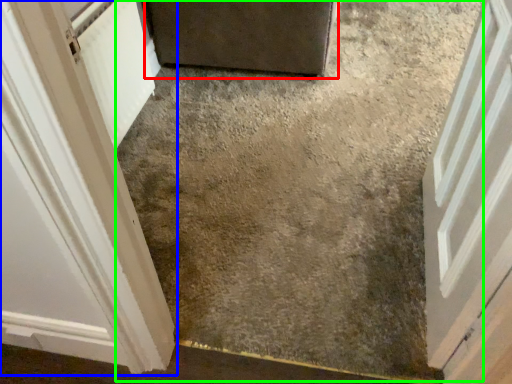
Question: Which object is positioned farthest from door (highlighted by a red box)? Select from door (highlighted by a blue box) and concrete (highlighted by a green box).

Choices:
 (A) door
 (B) concrete

Answer: (A)